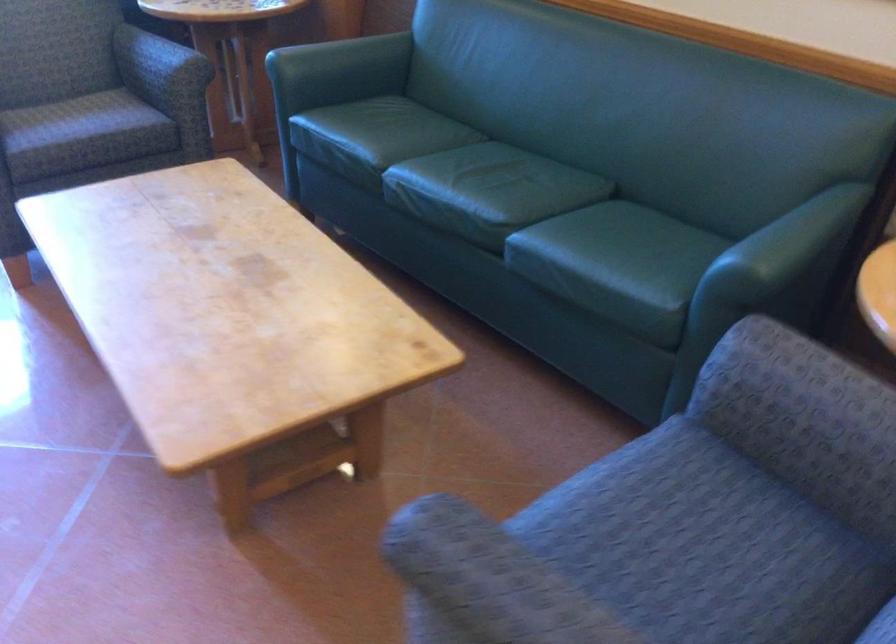
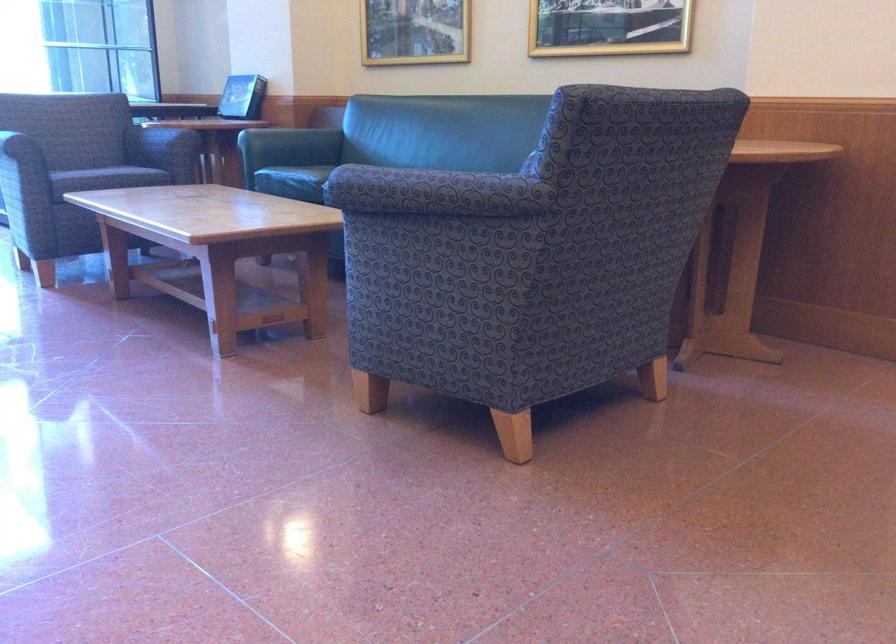
Question: I am providing you with two images of the same scene from different viewpoints. After the viewpoint changes to image2, which objects are now occluded?

Choices:
 (A) chair sitting surface
 (B) green sofa armrest
 (C) brown leather book
 (D) sofa armrest

Answer: (B)